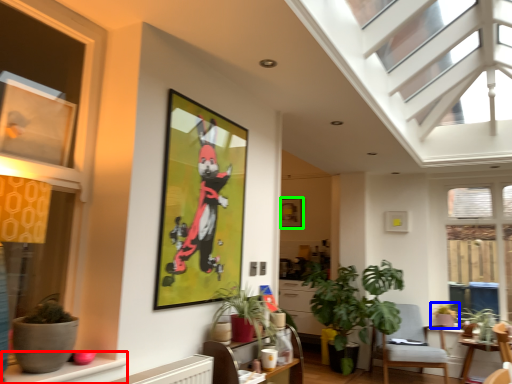
Question: Based on their relative distances, which object is farther from window sill (highlighted by a red box)? Choose from houseplant (highlighted by a blue box) and picture frame (highlighted by a green box).

Choices:
 (A) houseplant
 (B) picture frame

Answer: (A)